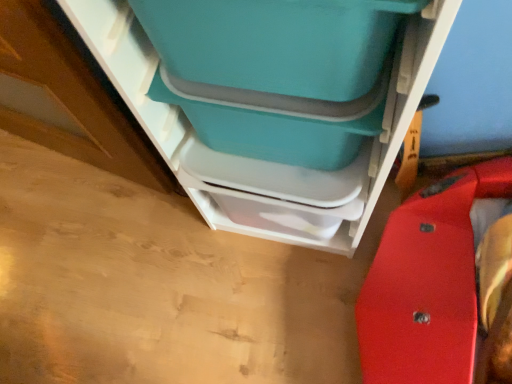
This screenshot has height=384, width=512. What do you see at coordinates (277, 72) in the screenshot?
I see `matte plastic storage container at center` at bounding box center [277, 72].

This screenshot has width=512, height=384. Identify the location of matte plastic storage container at center. (277, 72).

In order to face teal plastic storage bin at upper center, should I rotate leftwards or rightwards?

Turn right approximately 3.645 degrees to face it.

The height and width of the screenshot is (384, 512). What do you see at coordinates (263, 161) in the screenshot?
I see `teal plastic storage bin at upper center` at bounding box center [263, 161].

The width and height of the screenshot is (512, 384). I want to click on teal plastic storage bin at upper center, so click(x=263, y=161).

Where is `matte plastic storage container at center`? The height and width of the screenshot is (384, 512). matte plastic storage container at center is located at coordinates (277, 72).

Based on their positions, is teal plastic storage bin at upper center located to the left or right of matte plastic storage container at center?

Clearly, teal plastic storage bin at upper center is on the right of matte plastic storage container at center in the image.

Who is more distant, teal plastic storage bin at upper center or matte plastic storage container at center?

matte plastic storage container at center is further from the camera.

Is point (419, 49) farther from viewer compared to point (179, 106)?

No, (419, 49) is in front of (179, 106).

From the image's perspective, which is above, teal plastic storage bin at upper center or matte plastic storage container at center?

matte plastic storage container at center, from the image's perspective.

From a real-world perspective, relative to matte plastic storage container at center, is teal plastic storage bin at upper center vertically above or below?

teal plastic storage bin at upper center is situated lower than matte plastic storage container at center in the real world.

Looking at this image, which of these two, teal plastic storage bin at upper center or matte plastic storage container at center, is wider?

teal plastic storage bin at upper center.

Between teal plastic storage bin at upper center and matte plastic storage container at center, which one has more height?

teal plastic storage bin at upper center is taller.

Between teal plastic storage bin at upper center and matte plastic storage container at center, which one has smaller size?

Smaller between the two is matte plastic storage container at center.

Is matte plastic storage container at center inside teal plastic storage bin at upper center?

Yes, teal plastic storage bin at upper center contains matte plastic storage container at center.

Is teal plastic storage bin at upper center not near matte plastic storage container at center?

No, teal plastic storage bin at upper center is not far from matte plastic storage container at center.

Based on the photo, could you tell me if teal plastic storage bin at upper center is facing matte plastic storage container at center?

Yes.

How many degrees apart are the facing directions of teal plastic storage bin at upper center and matte plastic storage container at center?

teal plastic storage bin at upper center and matte plastic storage container at center are facing 1.72 degrees away from each other.

Identify the location of furniture to the right of matte plastic storage container at center. The width and height of the screenshot is (512, 384). (263, 161).

Which object is positioned more to the right, matte plastic storage container at center or teal plastic storage bin at upper center?

teal plastic storage bin at upper center is more to the right.

Is matte plastic storage container at center closer to camera compared to teal plastic storage bin at upper center?

No, matte plastic storage container at center is behind teal plastic storage bin at upper center.

Considering the points (263, 74) and (441, 40), which point is behind, point (263, 74) or point (441, 40)?

The point (263, 74) is farther from the camera.

From the image's perspective, relative to teal plastic storage bin at upper center, is matte plastic storage container at center above or below?

matte plastic storage container at center is above teal plastic storage bin at upper center.

From a real-world perspective, is matte plastic storage container at center on top of teal plastic storage bin at upper center?

Correct, in the physical world, matte plastic storage container at center is higher than teal plastic storage bin at upper center.

In the scene shown: Can you confirm if matte plastic storage container at center is thinner than teal plastic storage bin at upper center?

Indeed, matte plastic storage container at center has a lesser width compared to teal plastic storage bin at upper center.

Does matte plastic storage container at center have a greater height compared to teal plastic storage bin at upper center?

In fact, matte plastic storage container at center may be shorter than teal plastic storage bin at upper center.

Based on their sizes in the image, would you say matte plastic storage container at center is bigger or smaller than teal plastic storage bin at upper center?

Considering their sizes, matte plastic storage container at center takes up less space than teal plastic storage bin at upper center.

Is matte plastic storage container at center located outside teal plastic storage bin at upper center?

No.

Is the surface of matte plastic storage container at center in direct contact with teal plastic storage bin at upper center?

No, matte plastic storage container at center is not with teal plastic storage bin at upper center.

Could you tell me if matte plastic storage container at center is facing teal plastic storage bin at upper center?

Yes, matte plastic storage container at center faces towards teal plastic storage bin at upper center.

How many degrees apart are the facing directions of matte plastic storage container at center and teal plastic storage bin at upper center?

They differ by 1.72 degrees in their facing directions.

Could you measure the distance between matte plastic storage container at center and teal plastic storage bin at upper center?

The distance of matte plastic storage container at center from teal plastic storage bin at upper center is 4.83 inches.

Locate an element on the screen. turquoise above the teal plastic storage bin at upper center (from the image's perspective) is located at coordinates (277, 72).

Locate an element on the screen. turquoise on the left of teal plastic storage bin at upper center is located at coordinates (277, 72).

Find the location of a particular element. furniture that is on the right side of matte plastic storage container at center is located at coordinates (x=263, y=161).